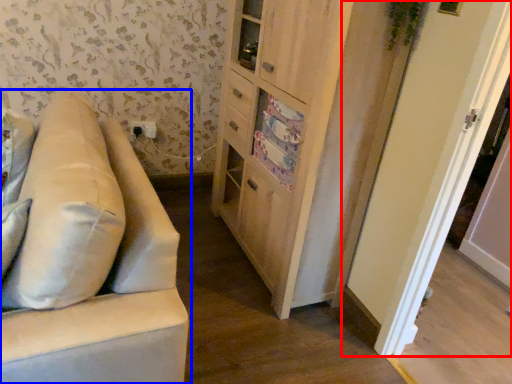
Question: Among these objects, which one is farthest to the camera, door (highlighted by a red box) or studio couch (highlighted by a blue box)?

Choices:
 (A) door
 (B) studio couch

Answer: (A)